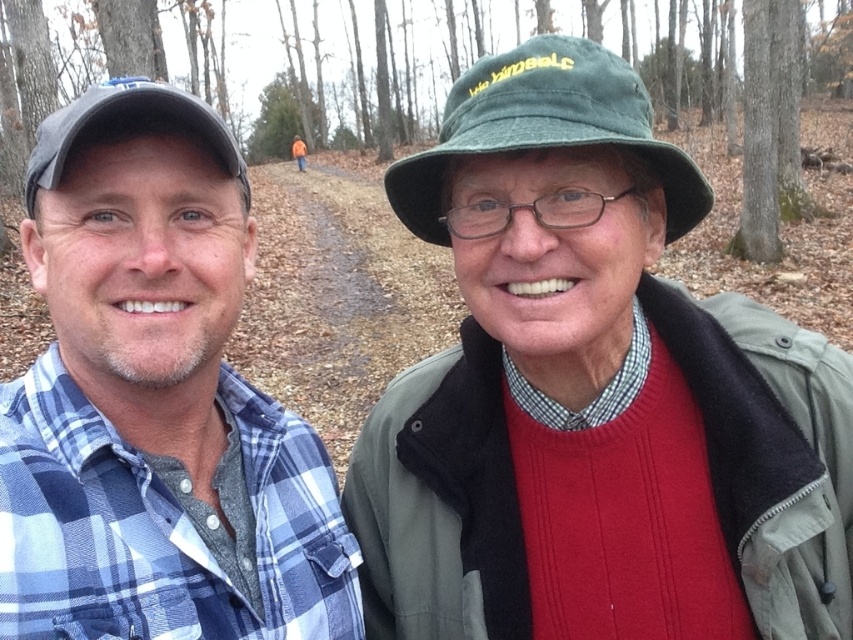
Looking at this image, you are a photographer trying to frame a shot that includes both the blue plaid shirt at left and the green fabric hat at center. Which object should you adjust your camera angle to ensure both are fully visible, considering their heights?

The blue plaid shirt at left is taller than the green fabric hat at center, so you should adjust your camera angle to account for the height of the blue plaid shirt at left to ensure both are fully visible.

You are a photographer trying to capture both the blue plaid shirt at left and the matte gray cap at left in the same frame. Since you can only focus on one subject at a time, which one should you focus on to ensure the other remains in the background?

You should focus on the blue plaid shirt at left because it is positioned to the right of the matte gray cap at left, so the cap will naturally be in the background.

You are a photographer trying to capture both the blue plaid shirt at left and the green fabric hat at center in a single frame. Given their sizes, which object should you focus on to ensure both are clearly visible in the photo?

The blue plaid shirt at left is larger than the green fabric hat at center, so focusing on the blue plaid shirt at left will help ensure both are clearly visible in the photo.